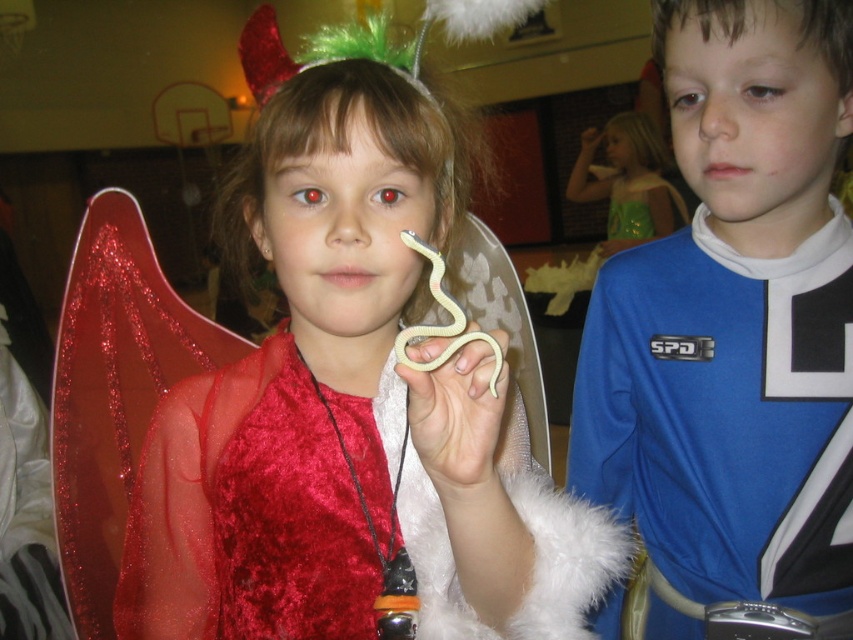
Based on the photo, is velvet red dress at center behind green velvet dress at upper right?

No, it is not.

Who is more distant from viewer, (422, 196) or (636, 131)?

Point (636, 131)

The image size is (853, 640). I want to click on velvet red dress at center, so click(x=352, y=401).

Is point (457, 392) positioned in front of point (664, 220)?

Yes, it is in front of point (664, 220).

Consider the image. Can you confirm if white matte snake at center is positioned above green velvet dress at upper right?

No, white matte snake at center is not above green velvet dress at upper right.

Does point (500, 332) lie behind point (621, 138)?

That is False.

Find the location of a particular element. white matte snake at center is located at coordinates (454, 401).

Does white matte snake at center have a greater height compared to matte yellow plastic snake at upper center?

No.

Does white matte snake at center appear over matte yellow plastic snake at upper center?

No.

The image size is (853, 640). What do you see at coordinates (454, 401) in the screenshot?
I see `white matte snake at center` at bounding box center [454, 401].

The image size is (853, 640). What are the coordinates of `white matte snake at center` in the screenshot? It's located at (454, 401).